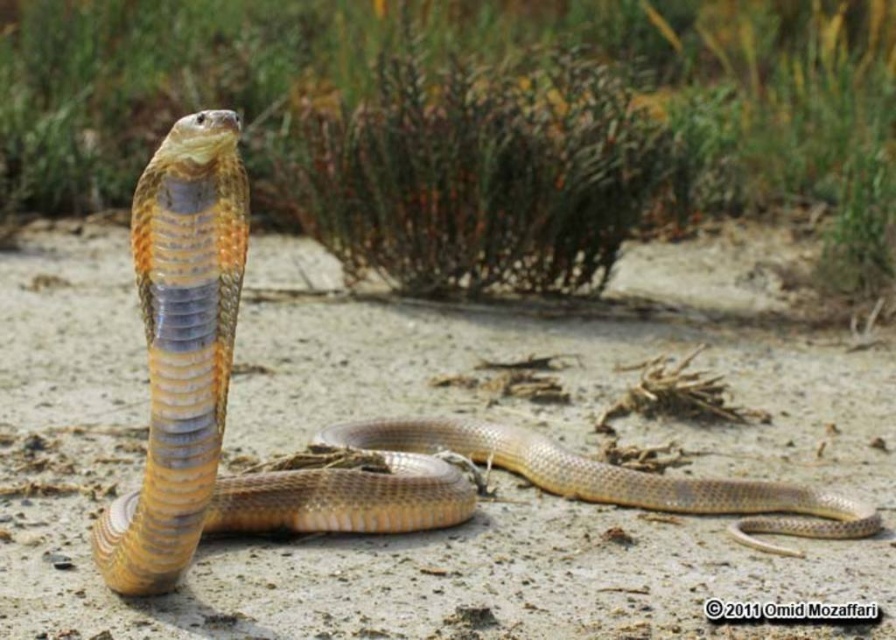
Who is positioned more to the right, smooth sand at center or shiny brown snake at center?

From the viewer's perspective, smooth sand at center appears more on the right side.

Does smooth sand at center have a greater width compared to shiny brown snake at center?

Indeed, smooth sand at center has a greater width compared to shiny brown snake at center.

Identify the location of smooth sand at center. This screenshot has height=640, width=896. click(x=436, y=416).